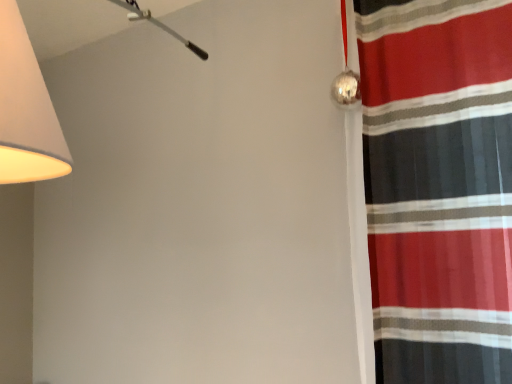
Image resolution: width=512 pixels, height=384 pixels. Describe the element at coordinates (26, 109) in the screenshot. I see `matte white lampshade at upper left` at that location.

Find the location of a particular element. This screenshot has height=384, width=512. matte white lampshade at upper left is located at coordinates (26, 109).

What is the approximate width of striped fabric curtain at right?

The width of striped fabric curtain at right is 9.38 inches.

The width and height of the screenshot is (512, 384). What are the coordinates of `striped fabric curtain at right` in the screenshot? It's located at (438, 186).

What do you see at coordinates (438, 186) in the screenshot?
I see `striped fabric curtain at right` at bounding box center [438, 186].

You are a GUI agent. You are given a task and a screenshot of the screen. Output one action in this format:
    pyautogui.click(x=<x>, y=<y>)
    Task: Click on the matte white lampshade at upper left
    
    Given the screenshot: What is the action you would take?
    pyautogui.click(x=26, y=109)

Considering the relative positions of matte white lampshade at upper left and striped fabric curtain at right in the image provided, is matte white lampshade at upper left to the left of striped fabric curtain at right from the viewer's perspective?

Indeed, matte white lampshade at upper left is positioned on the left side of striped fabric curtain at right.

Is matte white lampshade at upper left positioned behind striped fabric curtain at right?

That is False.

Based on the photo, which is farther, (x=20, y=64) or (x=508, y=72)?

The point (x=508, y=72) is farther.

From the image's perspective, is matte white lampshade at upper left located above striped fabric curtain at right?

Yes.

From a real-world perspective, which is physically below, matte white lampshade at upper left or striped fabric curtain at right?

In real-world perspective, striped fabric curtain at right is lower.

Considering the sizes of objects matte white lampshade at upper left and striped fabric curtain at right in the image provided, who is thinner, matte white lampshade at upper left or striped fabric curtain at right?

striped fabric curtain at right.

Can you confirm if matte white lampshade at upper left is shorter than striped fabric curtain at right?

Yes.

Can you confirm if matte white lampshade at upper left is smaller than striped fabric curtain at right?

No, matte white lampshade at upper left is not smaller than striped fabric curtain at right.

Is matte white lampshade at upper left located outside striped fabric curtain at right?

That's correct, matte white lampshade at upper left is outside of striped fabric curtain at right.

From the picture: Can you see matte white lampshade at upper left touching striped fabric curtain at right?

matte white lampshade at upper left and striped fabric curtain at right are clearly separated.

Is matte white lampshade at upper left facing towards striped fabric curtain at right?

No, matte white lampshade at upper left is not turned towards striped fabric curtain at right.

Where is `lamp in front of the striped fabric curtain at right`? lamp in front of the striped fabric curtain at right is located at coordinates (26, 109).

Is striped fabric curtain at right at the left side of matte white lampshade at upper left?

In fact, striped fabric curtain at right is to the right of matte white lampshade at upper left.

Is striped fabric curtain at right in front of or behind matte white lampshade at upper left in the image?

Visually, striped fabric curtain at right is located behind matte white lampshade at upper left.

Is point (493, 346) more distant than point (15, 17)?

Yes, point (493, 346) is behind point (15, 17).

From the image's perspective, which one is positioned lower, striped fabric curtain at right or matte white lampshade at upper left?

striped fabric curtain at right appears lower in the image.

From a real-world perspective, does striped fabric curtain at right stand above matte white lampshade at upper left?

No.

Which object is thinner, striped fabric curtain at right or matte white lampshade at upper left?

With smaller width is striped fabric curtain at right.

Considering the sizes of objects striped fabric curtain at right and matte white lampshade at upper left in the image provided, who is taller, striped fabric curtain at right or matte white lampshade at upper left?

Standing taller between the two is striped fabric curtain at right.

Based on their sizes in the image, would you say striped fabric curtain at right is bigger or smaller than matte white lampshade at upper left?

Considering their sizes, striped fabric curtain at right takes up less space than matte white lampshade at upper left.

Is striped fabric curtain at right surrounding matte white lampshade at upper left?

Actually, matte white lampshade at upper left is outside striped fabric curtain at right.

Are striped fabric curtain at right and matte white lampshade at upper left far apart?

That's right, there is a large distance between striped fabric curtain at right and matte white lampshade at upper left.

Is striped fabric curtain at right oriented away from matte white lampshade at upper left?

No, striped fabric curtain at right is not facing away from matte white lampshade at upper left.

How different are the orientations of striped fabric curtain at right and matte white lampshade at upper left in degrees?

They differ by 6.47 degrees in their facing directions.

Identify the location of curtain behind the matte white lampshade at upper left. The height and width of the screenshot is (384, 512). (438, 186).

Find the location of `curtain on the right side of matte white lampshade at upper left`. curtain on the right side of matte white lampshade at upper left is located at coordinates (438, 186).

What are the coordinates of `lamp positioned vertically above the striped fabric curtain at right (from a real-world perspective)` in the screenshot? It's located at [x=26, y=109].